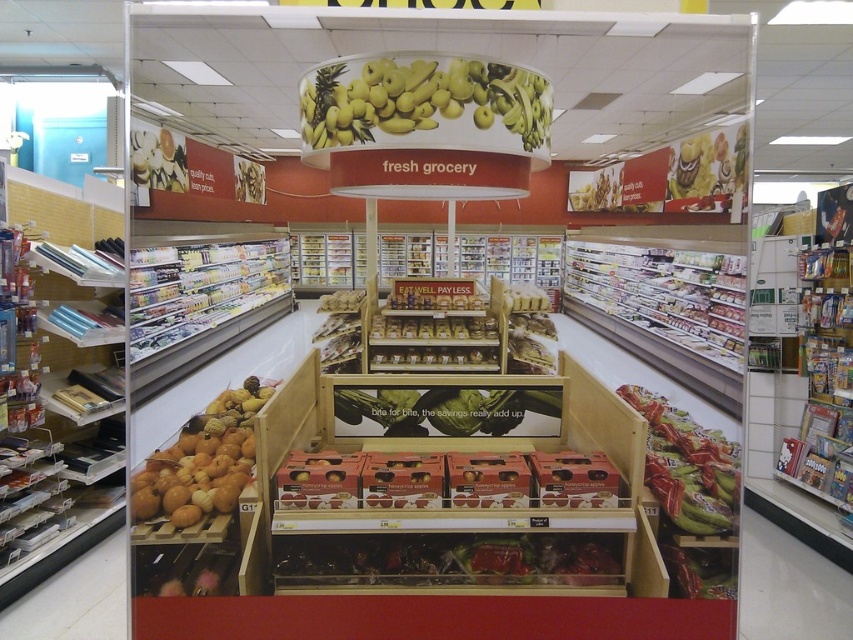
Does point (381, 84) lie behind point (451, 433)?

No, (381, 84) is closer to viewer.

What are the coordinates of `yellow matte bananas at upper center` in the screenshot? It's located at (426, 104).

Is point (381, 138) closer to camera compared to point (339, 419)?

Yes, point (381, 138) is closer to viewer.

Identify the location of yellow matte bananas at upper center. (426, 104).

From the picture: Is shiny dark chocolate at center wider than orange matte fruit at lower left?

Indeed, shiny dark chocolate at center has a greater width compared to orange matte fruit at lower left.

Which is behind, point (527, 561) or point (166, 484)?

Point (527, 561)

Is point (404, 564) positioned behind point (151, 497)?

That is True.

At what (x,y) coordinates should I click in order to perform the action: click on shiny dark chocolate at center. Please return your answer as a coordinate pair (x, y). The width and height of the screenshot is (853, 640). Looking at the image, I should click on (448, 560).

Can you confirm if metallic silver shelf at center is bigger than orange matte fruit at lower left?

Yes, metallic silver shelf at center is bigger than orange matte fruit at lower left.

The height and width of the screenshot is (640, 853). What do you see at coordinates (665, 292) in the screenshot?
I see `metallic silver shelf at center` at bounding box center [665, 292].

The height and width of the screenshot is (640, 853). Identify the location of metallic silver shelf at center. (665, 292).